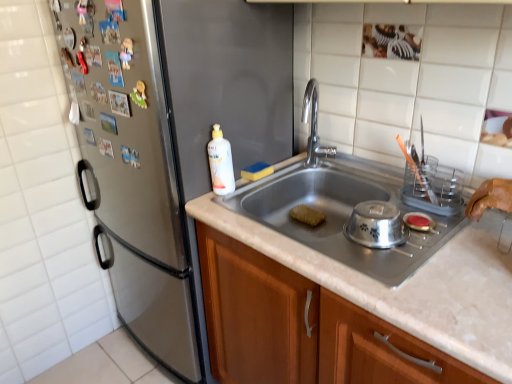
You are a GUI agent. You are given a task and a screenshot of the screen. Output one action in this format:
    pyautogui.click(x=<x>, y=<y>)
    Task: Click on the vacant space in front of white glossy bottle at center
    This screenshot has width=512, height=384.
    Given the screenshot: What is the action you would take?
    pyautogui.click(x=227, y=215)